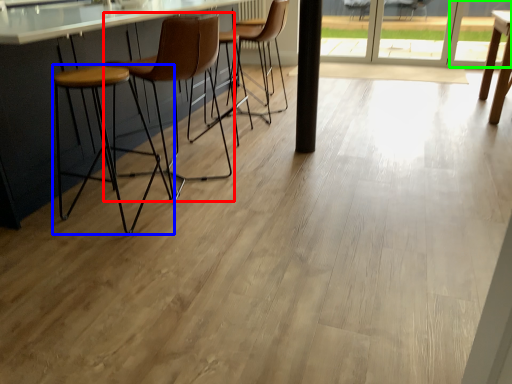
Question: Estimate the real-world distances between objects in this image. Which object is farther from chair (highlighted by a red box), stool (highlighted by a blue box) or window (highlighted by a green box)?

Choices:
 (A) stool
 (B) window

Answer: (B)